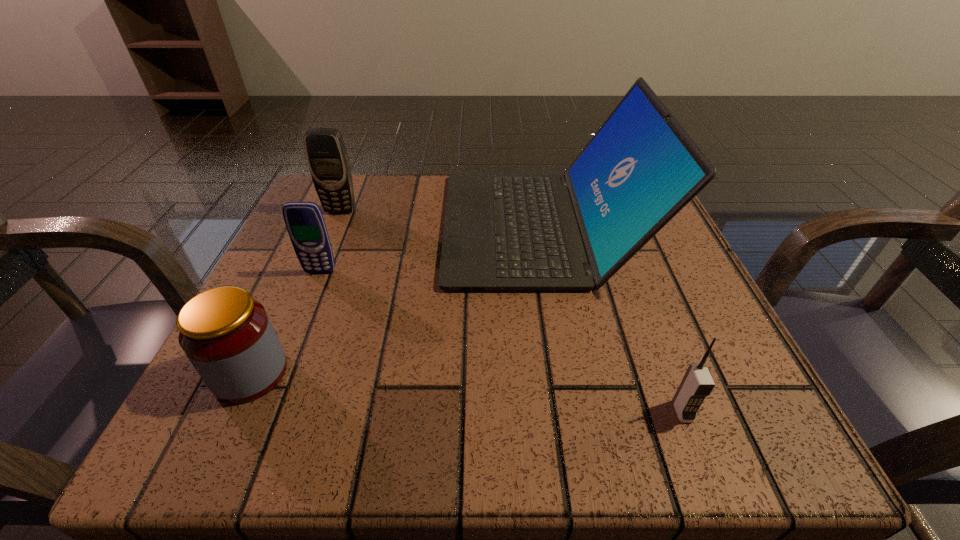
Locate an element on the screen. The width and height of the screenshot is (960, 540). laptop computer is located at coordinates (503, 231).

Find the location of a particular element. This screenshot has height=540, width=960. the farthest cellular telephone is located at coordinates (328, 161).

Where is `the tallest cellular telephone`? The width and height of the screenshot is (960, 540). the tallest cellular telephone is located at coordinates (328, 161).

The width and height of the screenshot is (960, 540). I want to click on the second nearest cellular telephone, so click(x=305, y=224).

The image size is (960, 540). I want to click on the rightmost cellular telephone, so click(x=697, y=383).

Image resolution: width=960 pixels, height=540 pixels. I want to click on jar, so click(x=227, y=335).

At what (x,y) coordinates should I click in order to perform the action: click on vacant space located 0.050m on the screen of the tallest object. Please return your answer as a coordinate pair (x, y). This screenshot has height=540, width=960. Looking at the image, I should click on (420, 225).

Identify the location of vacant region located on the screen of the tallest object. (321, 225).

I want to click on free space located 0.200m on the screen of the tallest object, so click(345, 225).

This screenshot has width=960, height=540. Identify the location of free space located 0.170m on the front face of the fourth shortest object. (316, 269).